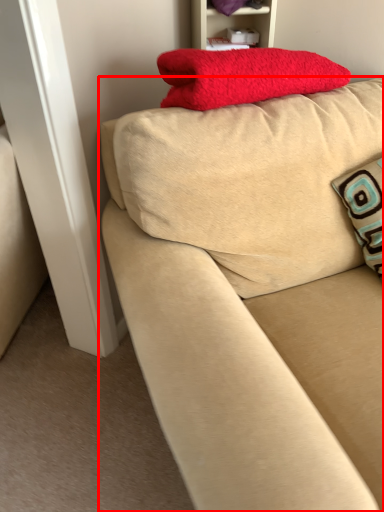
Question: Considering the relative positions of studio couch (annotated by the red box) and furniture in the image provided, where is studio couch (annotated by the red box) located with respect to the staircase?

Choices:
 (A) left
 (B) right

Answer: (B)